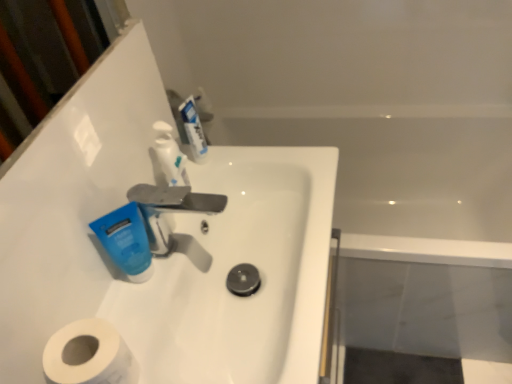
The width and height of the screenshot is (512, 384). Identify the location of free space to the right of white glossy soap dispenser at upper center. (280, 170).